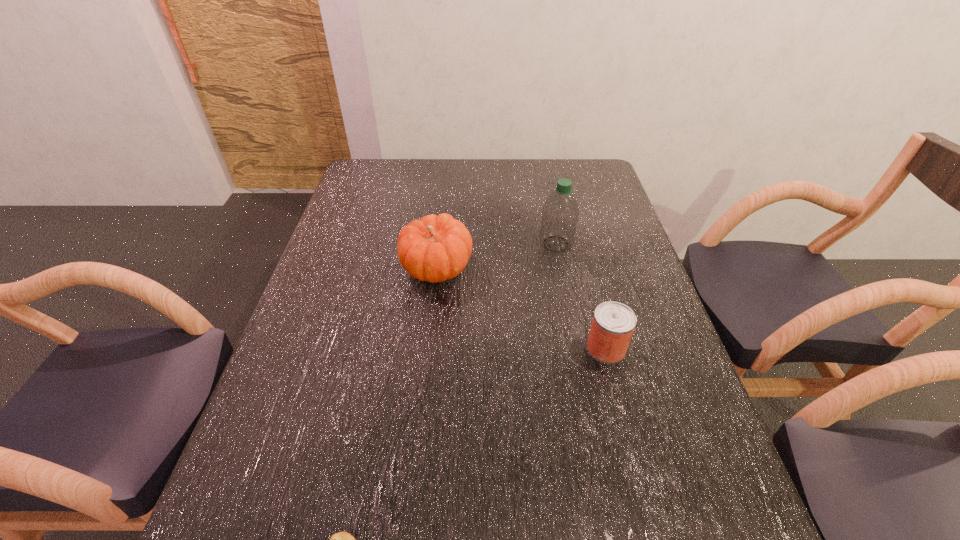
Identify the location of vacant space at the right edge. Image resolution: width=960 pixels, height=540 pixels. (608, 204).

In the image, there is a desktop. Identify the location of vacant space at the far right corner. tap(576, 161).

You are a GUI agent. You are given a task and a screenshot of the screen. Output one action in this format:
    pyautogui.click(x=<x>, y=<y>)
    Task: Click on the free area in between the third shortest object and the water bottle
    This screenshot has width=960, height=540.
    Given the screenshot: What is the action you would take?
    pyautogui.click(x=496, y=256)

Find the location of `free space between the third farthest object and the tallest object`. free space between the third farthest object and the tallest object is located at coordinates (581, 296).

Find the location of a particular element. Image resolution: width=960 pixels, height=540 pixels. free space between the third farthest object and the water bottle is located at coordinates (581, 296).

This screenshot has width=960, height=540. Find the location of `free space between the pumpkin and the can`. free space between the pumpkin and the can is located at coordinates (521, 308).

Identify the location of vacant space that's between the pumpkin and the can. (521, 308).

The height and width of the screenshot is (540, 960). In order to click on object that is the closest to the tallest object in this screenshot , I will do `click(436, 248)`.

Locate which object is the third closest to the nearest object. Please provide its 2D coordinates. Your answer should be formatted as a tuple, i.e. [(x, y)], where the tuple contains the x and y coordinates of a point satisfying the conditions above.

[(560, 213)]

Image resolution: width=960 pixels, height=540 pixels. I want to click on vacant space that satisfies the following two spatial constraints: 1. on the front side of the tallest object; 2. on the left side of the third farthest object, so click(577, 348).